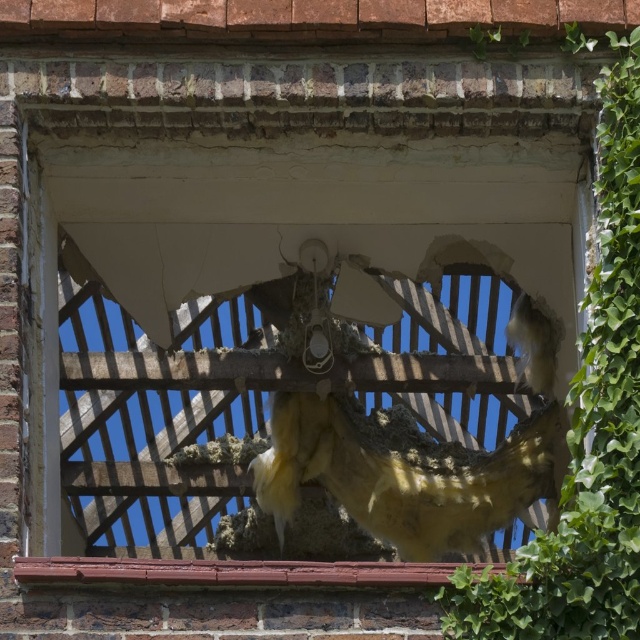
Is fuzzy yellow bird at center shorter than smooth brick window sill at lower center?

Incorrect, fuzzy yellow bird at center's height does not fall short of smooth brick window sill at lower center's.

Can you confirm if fuzzy yellow bird at center is thinner than smooth brick window sill at lower center?

Yes.

Is point (278, 529) more distant than point (243, 582)?

That is True.

Locate an element on the screen. The width and height of the screenshot is (640, 640). fuzzy yellow bird at center is located at coordinates (401, 477).

Is point (538, 611) closer to camera compared to point (401, 515)?

Yes, point (538, 611) is closer to viewer.

Is point (604, 528) more distant than point (282, 481)?

No, it is in front of (282, 481).

Between point (497, 593) and point (538, 435), which one is positioned behind?

Positioned behind is point (538, 435).

Locate an element on the screen. The image size is (640, 640). green leafy ivy at right is located at coordinates (586, 429).

Is point (614, 515) less distant than point (397, 579)?

No, it is not.

Between green leafy ivy at right and smooth brick window sill at lower center, which one is positioned lower?

smooth brick window sill at lower center is below.

Where is `green leafy ivy at right`? green leafy ivy at right is located at coordinates [586, 429].

Locate an element on the screen. green leafy ivy at right is located at coordinates (586, 429).